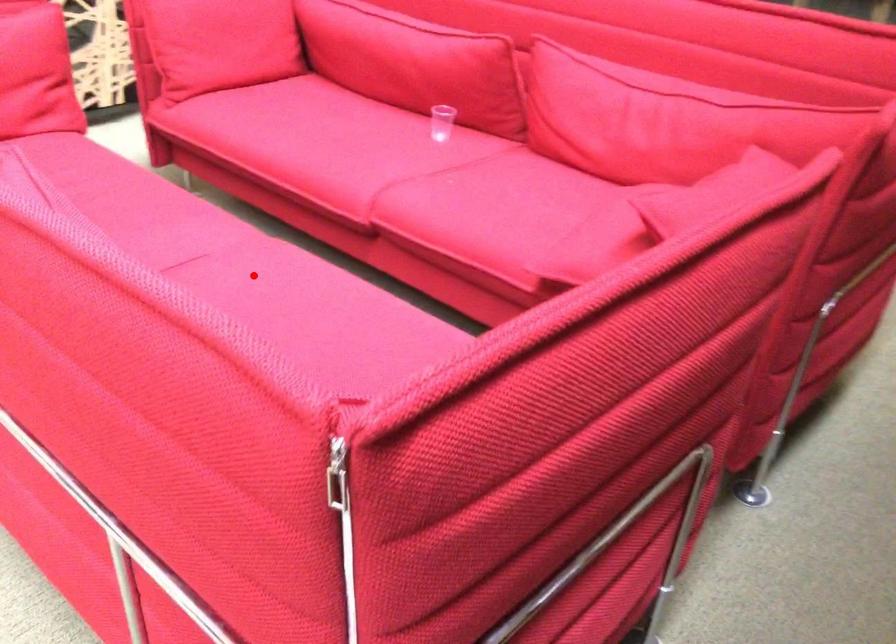
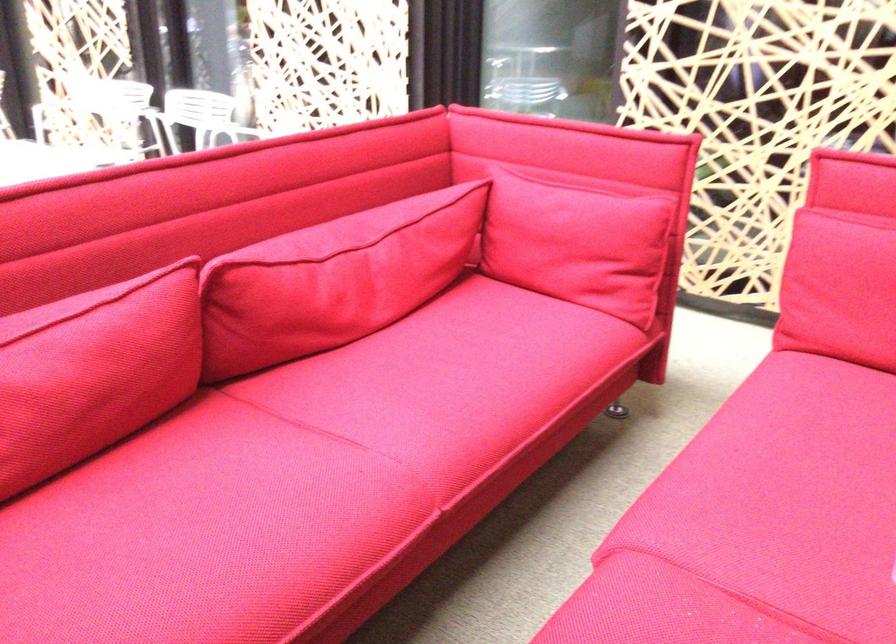
Where in the second image is the point corresponding to the highlighted location from the first image?

(298, 476)